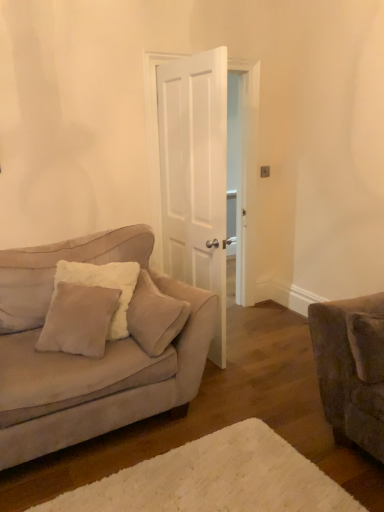
Question: Is suede couch at left behind beige plush pillow at left, which is the 2th pillow from left to right?

Choices:
 (A) no
 (B) yes

Answer: (A)

Question: Is suede couch at left at the left side of beige plush pillow at left, which is the 2th pillow from left to right?

Choices:
 (A) yes
 (B) no

Answer: (A)

Question: From the image's perspective, is suede couch at left above beige plush pillow at left, which is the 2th pillow from left to right?

Choices:
 (A) no
 (B) yes

Answer: (A)

Question: Does suede couch at left come in front of beige plush pillow at left, marked as the second pillow in a right-to-left arrangement?

Choices:
 (A) yes
 (B) no

Answer: (A)

Question: Considering the relative sizes of suede couch at left and beige plush pillow at left, marked as the second pillow in a right-to-left arrangement, in the image provided, is suede couch at left bigger than beige plush pillow at left, marked as the second pillow in a right-to-left arrangement,?

Choices:
 (A) yes
 (B) no

Answer: (A)

Question: Is white fluffy rug at lower center taller or shorter than suede couch at left?

Choices:
 (A) short
 (B) tall

Answer: (A)

Question: In the image, is white fluffy rug at lower center on the left side or the right side of suede couch at left?

Choices:
 (A) left
 (B) right

Answer: (B)

Question: Considering the positions of white fluffy rug at lower center and suede couch at left in the image, is white fluffy rug at lower center bigger or smaller than suede couch at left?

Choices:
 (A) big
 (B) small

Answer: (B)

Question: Is white fluffy rug at lower center inside the boundaries of suede couch at left, or outside?

Choices:
 (A) inside
 (B) outside

Answer: (B)

Question: From a real-world perspective, is white matte door at center positioned above or below beige plush pillow at left, marked as the second pillow in a right-to-left arrangement?

Choices:
 (A) below
 (B) above

Answer: (B)

Question: From the image's perspective, is white matte door at center positioned above or below beige plush pillow at left, marked as the second pillow in a right-to-left arrangement?

Choices:
 (A) below
 (B) above

Answer: (B)

Question: From their relative heights in the image, would you say white matte door at center is taller or shorter than beige plush pillow at left, marked as the second pillow in a right-to-left arrangement?

Choices:
 (A) tall
 (B) short

Answer: (A)

Question: Is point (152, 256) closer or farther from the camera than point (163, 307)?

Choices:
 (A) closer
 (B) farther

Answer: (B)

Question: Looking at the image, does white matte door at center seem bigger or smaller compared to white fluffy rug at lower center?

Choices:
 (A) big
 (B) small

Answer: (A)

Question: Relative to white fluffy rug at lower center, is white matte door at center in front or behind?

Choices:
 (A) behind
 (B) front

Answer: (A)